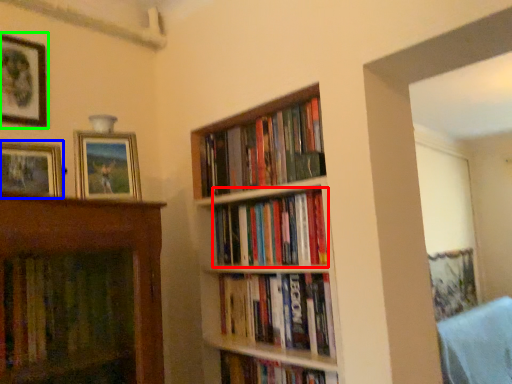
Question: Estimate the real-world distances between objects in this image. Which object is farther from book (highlighted by a red box), picture frame (highlighted by a blue box) or picture frame (highlighted by a green box)?

Choices:
 (A) picture frame
 (B) picture frame

Answer: (B)